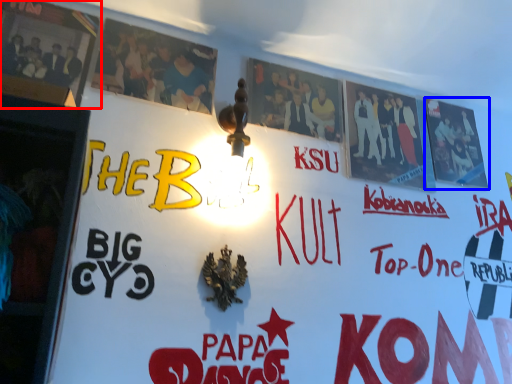
Question: Which object appears farthest to the camera in this image, poster (highlighted by a red box) or poster (highlighted by a blue box)?

Choices:
 (A) poster
 (B) poster

Answer: (B)